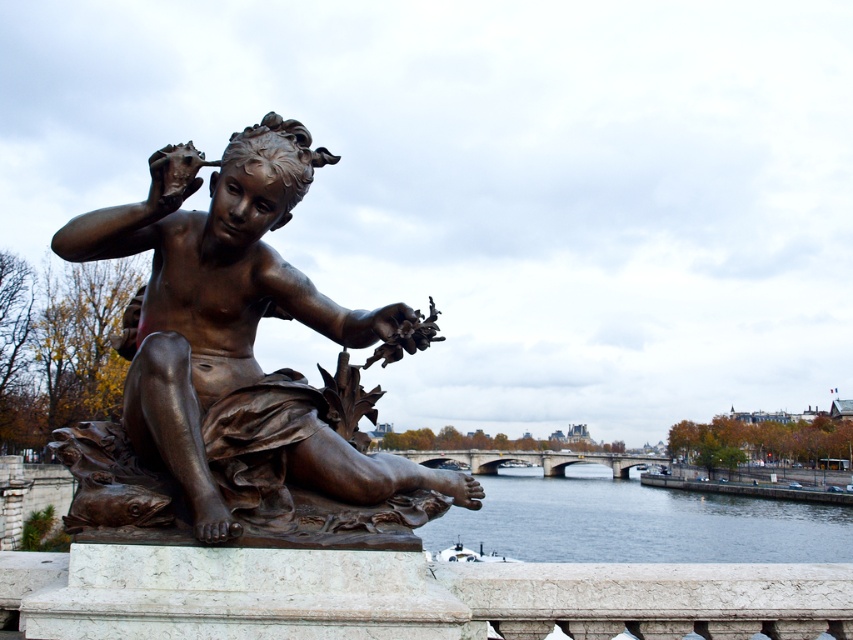
Between bronze statue at center and dark blue water at lower center, which one is positioned higher?

Positioned higher is bronze statue at center.

Can you confirm if bronze statue at center is positioned to the left of dark blue water at lower center?

Correct, you'll find bronze statue at center to the left of dark blue water at lower center.

Which is behind, point (117, 448) or point (564, 518)?

The point (564, 518) is behind.

Where is `bronze statue at center`? This screenshot has height=640, width=853. bronze statue at center is located at coordinates (239, 374).